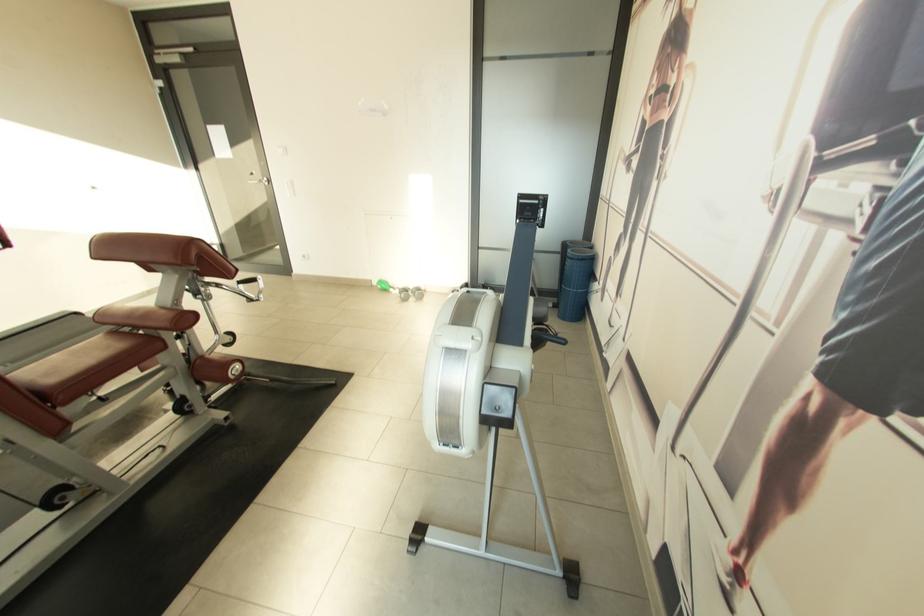
The location [404,292] corresponds to which object?

It refers to a green dumbbell.